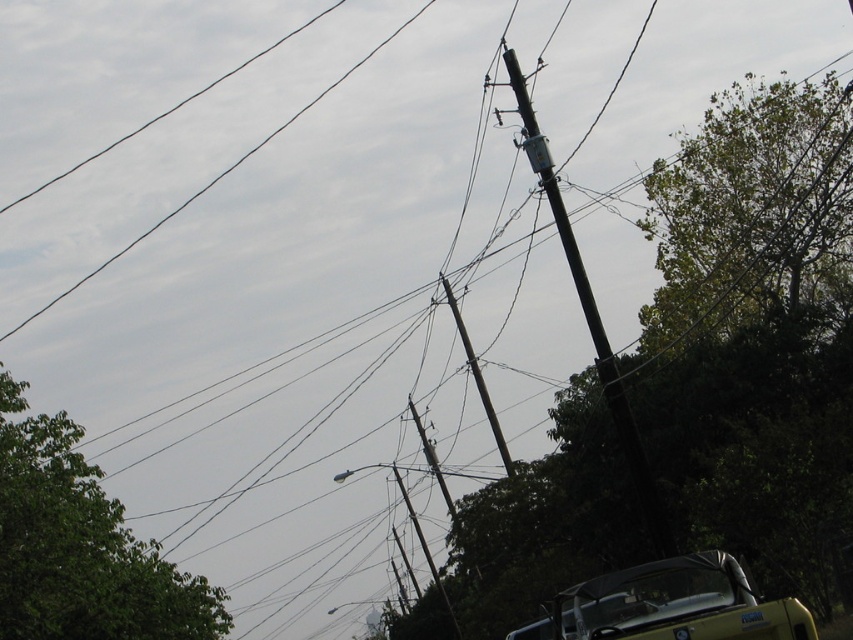
Question: Which point is farther to the camera?

Choices:
 (A) (521, 90)
 (B) (850, 132)

Answer: (B)

Question: Among these points, which one is farthest from the camera?

Choices:
 (A) (640, 604)
 (B) (637, 556)

Answer: (B)

Question: Can you confirm if black metallic pole at upper center is wider than brown wooden telegraph pole at center?

Choices:
 (A) no
 (B) yes

Answer: (B)

Question: Can you confirm if green leafy tree at lower left is smaller than black metallic pole at upper center?

Choices:
 (A) no
 (B) yes

Answer: (B)

Question: Can you confirm if black metallic pole at upper center is bigger than brown wooden telegraph pole at center?

Choices:
 (A) yes
 (B) no

Answer: (A)

Question: Based on their relative distances, which object is nearer to the yellow matte convertible at lower right?

Choices:
 (A) green leafy tree at lower left
 (B) brown wooden telegraph pole at center
 (C) green leafy tree at upper right
 (D) black metallic pole at upper center

Answer: (D)